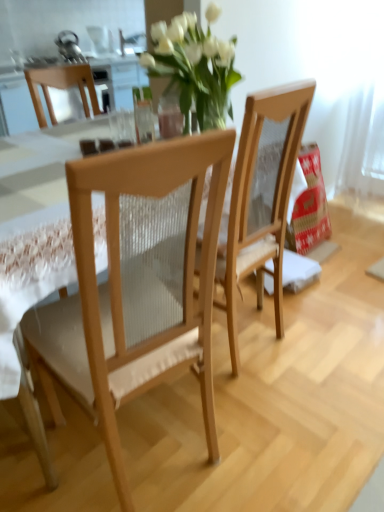
Question: From a real-world perspective, is light wood mesh chair at center, the second chair viewed from the right, positioned above or below natural wood chair at center, marked as the 1th chair in a right-to-left arrangement?

Choices:
 (A) above
 (B) below

Answer: (B)

Question: Is light wood mesh chair at center, the second chair viewed from the right, inside the boundaries of natural wood chair at center, the 2th chair in the left-to-right sequence, or outside?

Choices:
 (A) outside
 (B) inside

Answer: (A)

Question: Looking at their shapes, would you say light wood mesh chair at center, the second chair viewed from the right, is wider or thinner than natural wood chair at center, the 2th chair in the left-to-right sequence?

Choices:
 (A) wide
 (B) thin

Answer: (A)

Question: From the image's perspective, is natural wood chair at center, marked as the 1th chair in a right-to-left arrangement, above or below light wood mesh chair at center, the first chair viewed from the left?

Choices:
 (A) below
 (B) above

Answer: (B)

Question: Considering the positions of natural wood chair at center, marked as the 1th chair in a right-to-left arrangement, and light wood mesh chair at center, the first chair viewed from the left, in the image, is natural wood chair at center, marked as the 1th chair in a right-to-left arrangement, wider or thinner than light wood mesh chair at center, the first chair viewed from the left,?

Choices:
 (A) wide
 (B) thin

Answer: (B)

Question: Would you say natural wood chair at center, marked as the 1th chair in a right-to-left arrangement, is to the left or to the right of light wood mesh chair at center, the first chair viewed from the left, in the picture?

Choices:
 (A) right
 (B) left

Answer: (A)

Question: Does point pyautogui.click(x=289, y=112) appear closer or farther from the camera than point pyautogui.click(x=115, y=256)?

Choices:
 (A) closer
 (B) farther

Answer: (B)